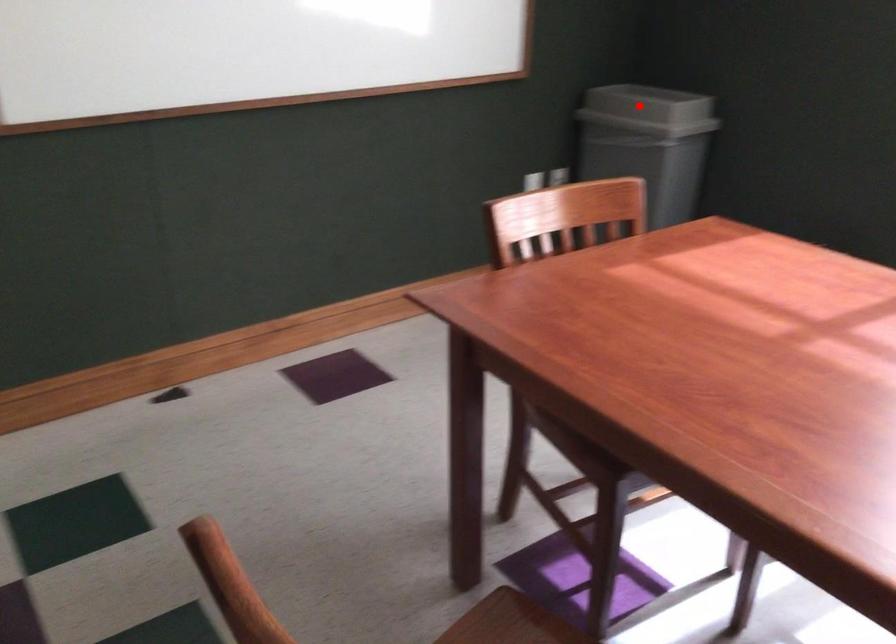
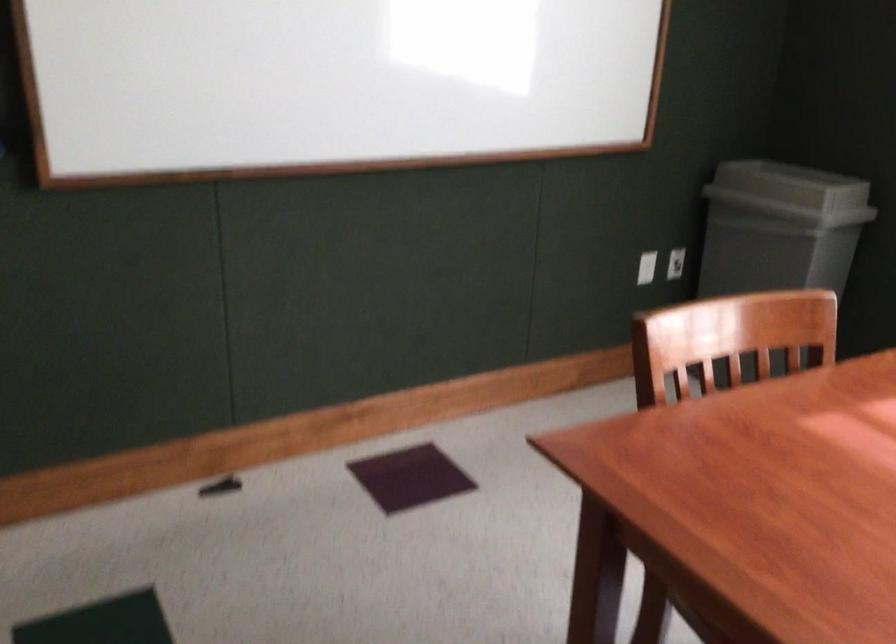
Where in the second image is the point corresponding to the highlighted location from the first image?

(791, 185)